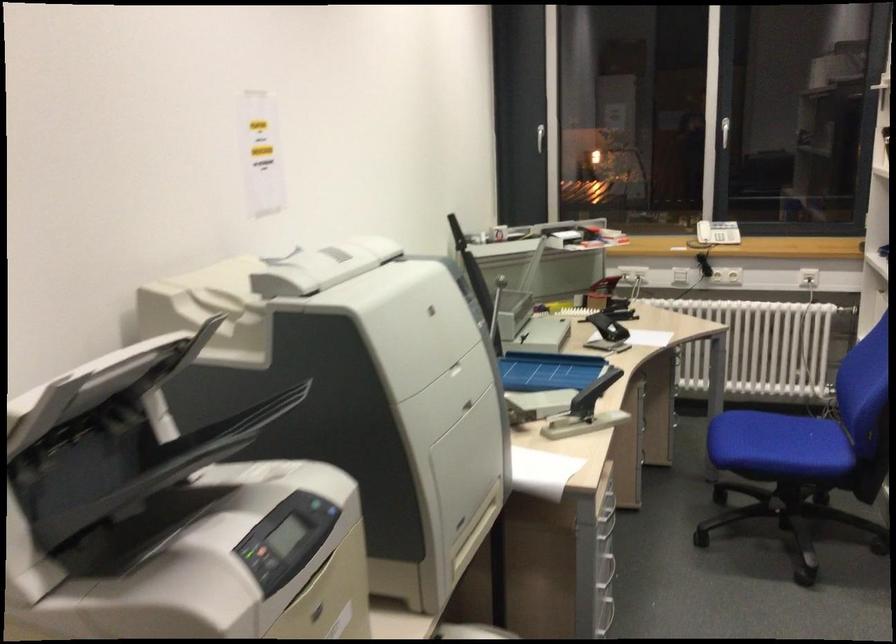
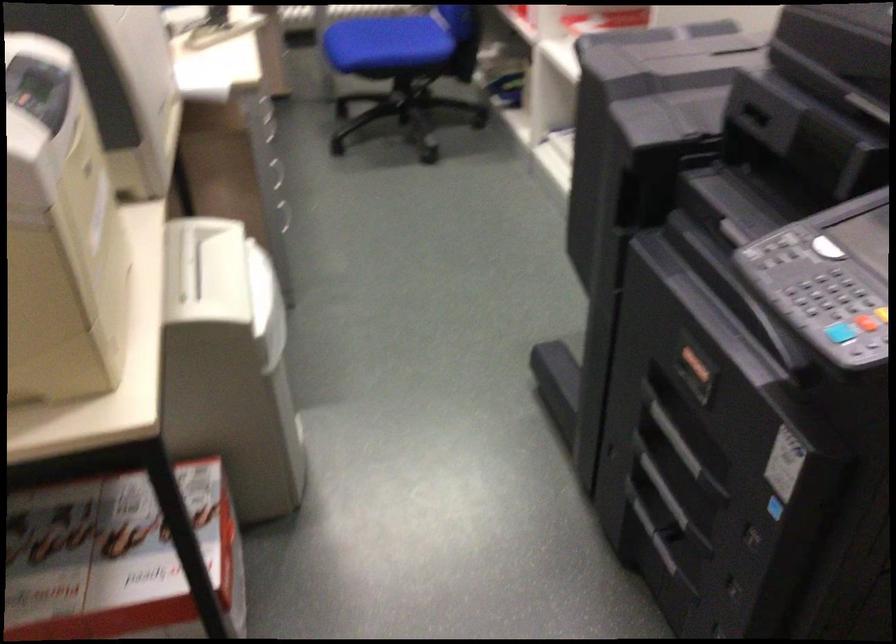
How did the camera likely rotate?

The rotation direction of the camera is right-down.